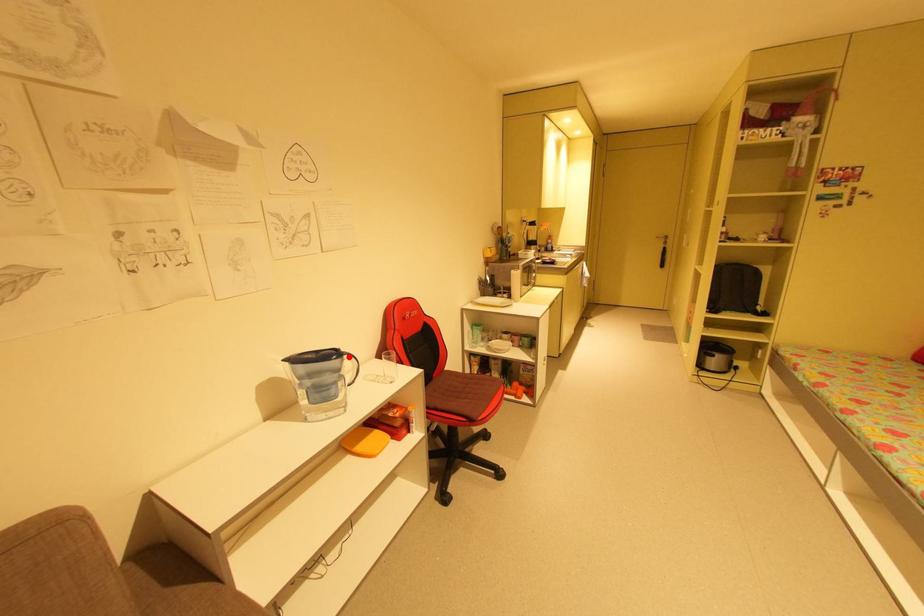
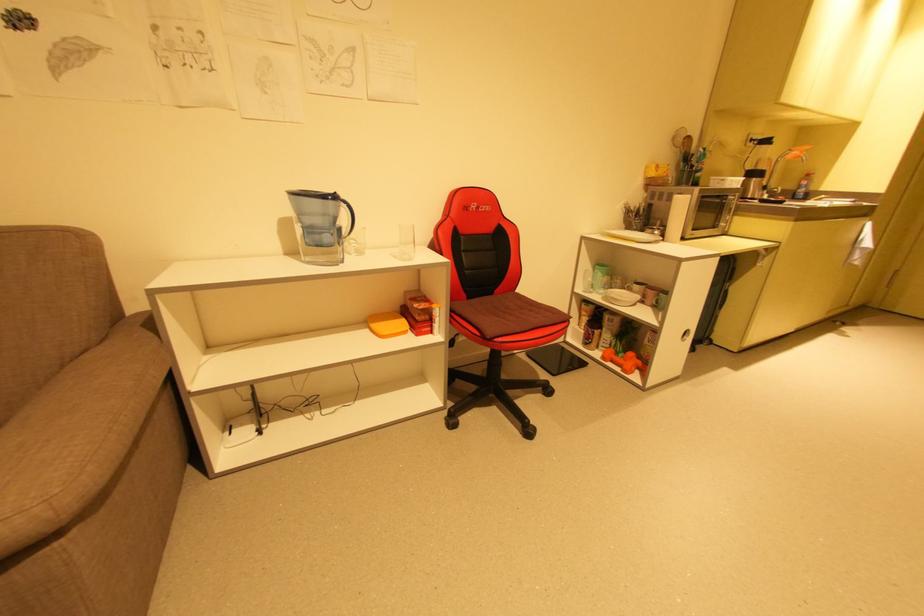
Question: A red point is marked in image1. In image2, is the corresponding 3D point closer to the camera or farther? Reply with the corresponding letter.

Choices:
 (A) The corresponding 3D point is closer.
 (B) The corresponding 3D point is farther.

Answer: (B)